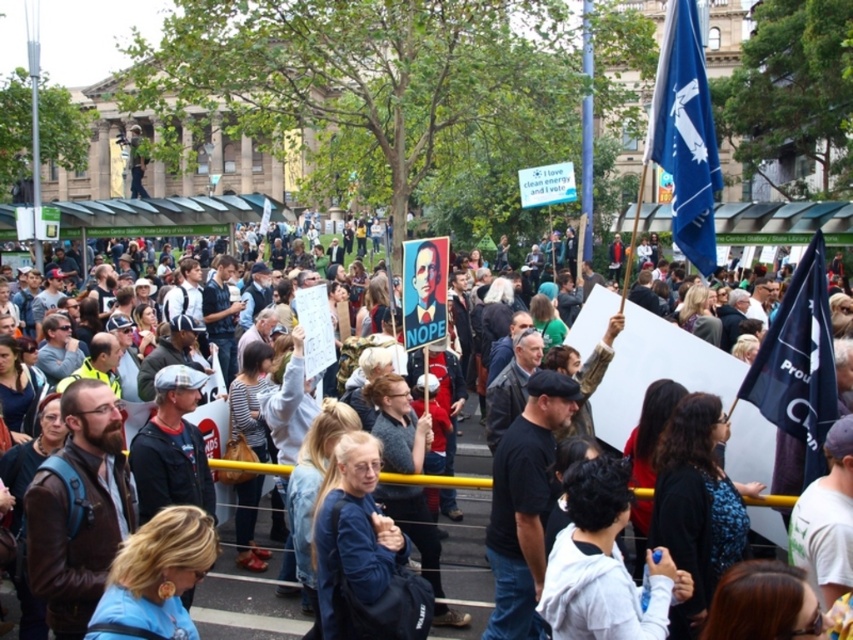
You are a photographer trying to capture both the white paper sign at center and the blue fabric flag at upper right in a single frame. Given their distance apart, what is the minimum focal length lens you should use if your camera sensor has a diagonal of 24mm and you want to include both objects without cropping?

The white paper sign at center and blue fabric flag at upper right are 77.83 feet apart. To calculate the minimum focal length, use the formula Focal Length mm x 0.03937 x Distance in feet between objects divided by sensor diagonal in mm. Plugging in the numbers, the calculation would be Focal Length x 0.03937 x 77.83 divided by 24mm. However, without knowing the desired field of view or the distance from the camera to the objects, an exact focal length cannot be determined. The photographer must ensure the

You are a photographer standing at the camera position. You want to capture a closeup shot of the blue fabric flag at upper right. Given that your camera can focus on objects within 100 meters, will you be able to take a clear photo of the flag?

The blue fabric flag at upper right is 93.43 meters away from the camera. Since the camera can focus within 100 meters, the distance is within the focus range, so yes, you can take a clear photo of the blue fabric flag at upper right.